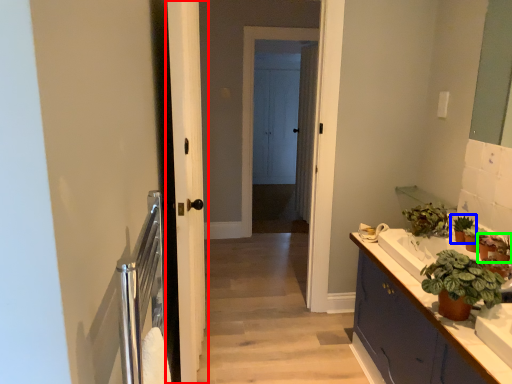
Question: Considering the real-world distances, which object is closest to door (highlighted by a red box)? houseplant (highlighted by a blue box) or houseplant (highlighted by a green box).

Choices:
 (A) houseplant
 (B) houseplant

Answer: (A)